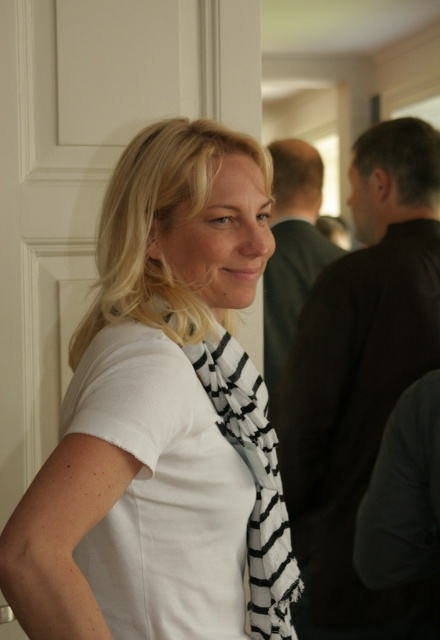
You are designing a layout for a fashion catalog and need to place the white matte scarf at center and the black matte vest at right in a vertical arrangement. Which item should be placed higher up to maintain visual balance?

The white matte scarf at center should be placed higher up because it is shorter than the black matte vest at right, helping to balance their heights in the vertical layout.

You are a fashion designer observing the scene. You need to decide whether the two scarves can be displayed together in a store window without overlapping. The store window requires a minimum of 10 centimeters between items. Can the white matte scarf at center and the black and white striped scarf at center be placed in the window as specified?

The white matte scarf at center and the black and white striped scarf at center are 8.97 centimeters apart, which is less than the required 10 centimeters. Therefore, they cannot be displayed together in the store window without overlapping as they do not meet the spacing requirement.

You are an interior designer planning to hang a picture frame exactly where the white matte scarf at center is currently positioned. The coordinates given are in a normalized system where the bottom left corner is the origin. Where on the wall should you mark the spot for the nail?

The white matte scarf at center is located at point coordinates 0.653 in the x axis and 0.370 in the y axis. Since the coordinate system has the bottom left corner as origin, you should mark the spot at 65.3 percent from the left edge and 37 percent from the bottom edge of the wall.